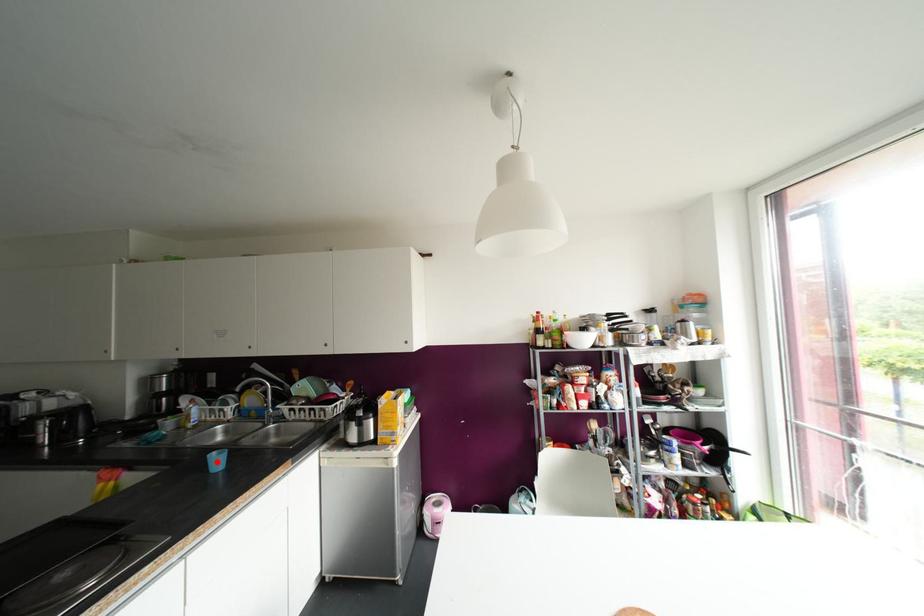
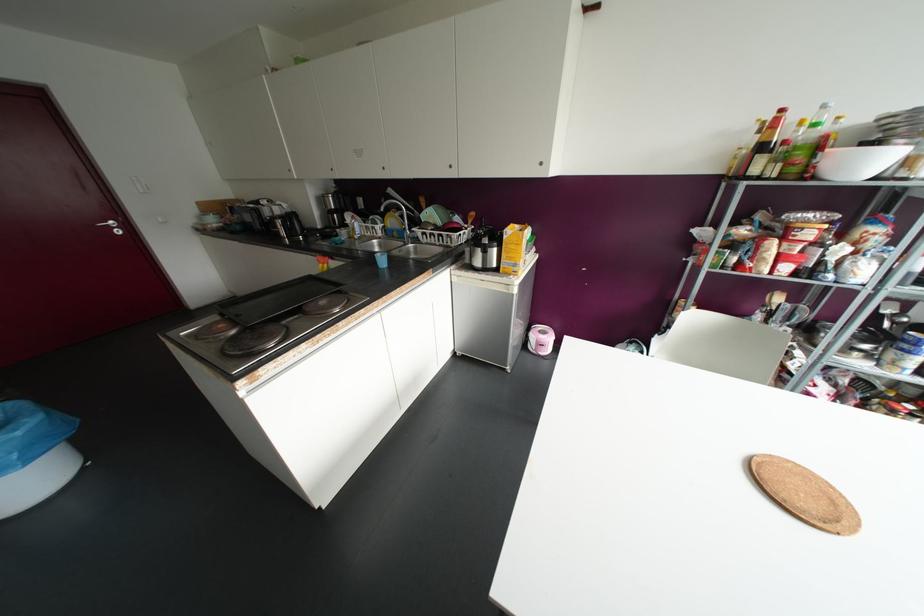
Question: I am providing you with two images of the same scene from different viewpoints. In image1, a red point is highlighted. Considering the same 3D point in image2, which of the following is correct?

Choices:
 (A) It is closer
 (B) It is farther

Answer: (A)